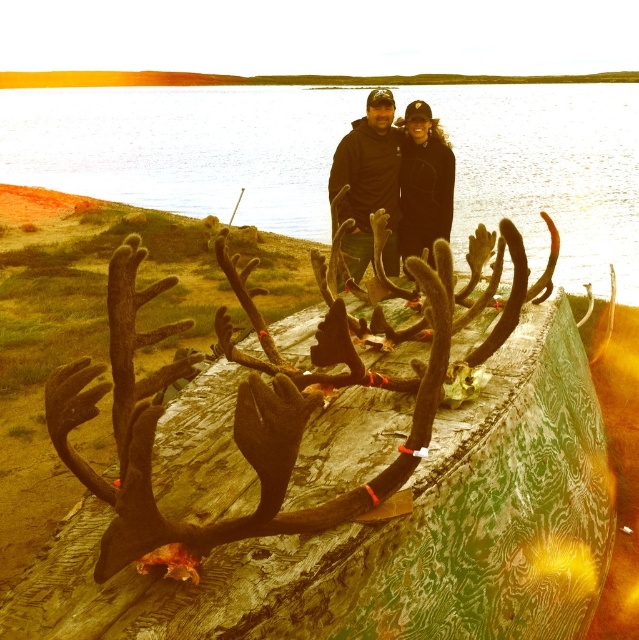
Question: Which point is farther to the camera?

Choices:
 (A) greenish water at upper center
 (B) matte black jacket at center
 (C) black fleece jacket at center

Answer: (A)

Question: Does greenish water at upper center have a larger size compared to black fleece jacket at center?

Choices:
 (A) yes
 (B) no

Answer: (A)

Question: Based on their relative distances, which object is farther from the matte black jacket at center?

Choices:
 (A) greenish water at upper center
 (B) black fleece jacket at center

Answer: (A)

Question: Where is greenish water at upper center located in relation to matte black jacket at center in the image?

Choices:
 (A) below
 (B) above

Answer: (B)

Question: Among these objects, which one is farthest from the camera?

Choices:
 (A) black fleece jacket at center
 (B) matte black jacket at center

Answer: (A)

Question: Does matte black jacket at center have a greater width compared to black fleece jacket at center?

Choices:
 (A) yes
 (B) no

Answer: (A)